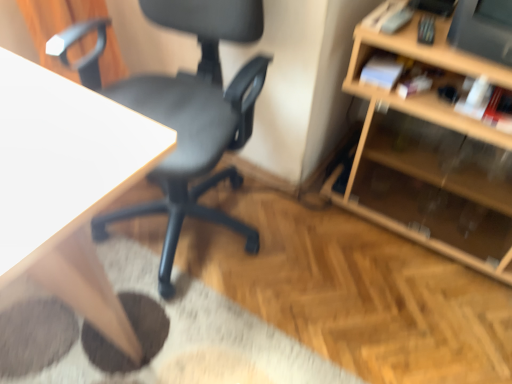
Question: Is white wood desk at upper left thinner than black plastic chair at center?

Choices:
 (A) yes
 (B) no

Answer: (B)

Question: Would you say white wood desk at upper left contains black plastic chair at center?

Choices:
 (A) yes
 (B) no

Answer: (B)

Question: From a real-world perspective, is white wood desk at upper left located higher than black plastic chair at center?

Choices:
 (A) yes
 (B) no

Answer: (B)

Question: Is white wood desk at upper left turned away from black plastic chair at center?

Choices:
 (A) yes
 (B) no

Answer: (B)

Question: From the image's perspective, is white wood desk at upper left located above black plastic chair at center?

Choices:
 (A) no
 (B) yes

Answer: (A)

Question: Is the depth of white wood desk at upper left greater than that of black plastic chair at center?

Choices:
 (A) yes
 (B) no

Answer: (B)

Question: Is wooden shelf at right surrounded by black plastic chair at center?

Choices:
 (A) yes
 (B) no

Answer: (B)

Question: Is black plastic chair at center directly adjacent to wooden shelf at right?

Choices:
 (A) no
 (B) yes

Answer: (A)

Question: Is black plastic chair at center located outside wooden shelf at right?

Choices:
 (A) yes
 (B) no

Answer: (A)

Question: From a real-world perspective, is black plastic chair at center located higher than wooden shelf at right?

Choices:
 (A) yes
 (B) no

Answer: (A)

Question: From the image's perspective, is black plastic chair at center under wooden shelf at right?

Choices:
 (A) yes
 (B) no

Answer: (B)

Question: Is black plastic chair at center to the left of wooden shelf at right from the viewer's perspective?

Choices:
 (A) no
 (B) yes

Answer: (B)

Question: Are wooden shelf at right and black plastic chair at center making contact?

Choices:
 (A) no
 (B) yes

Answer: (A)